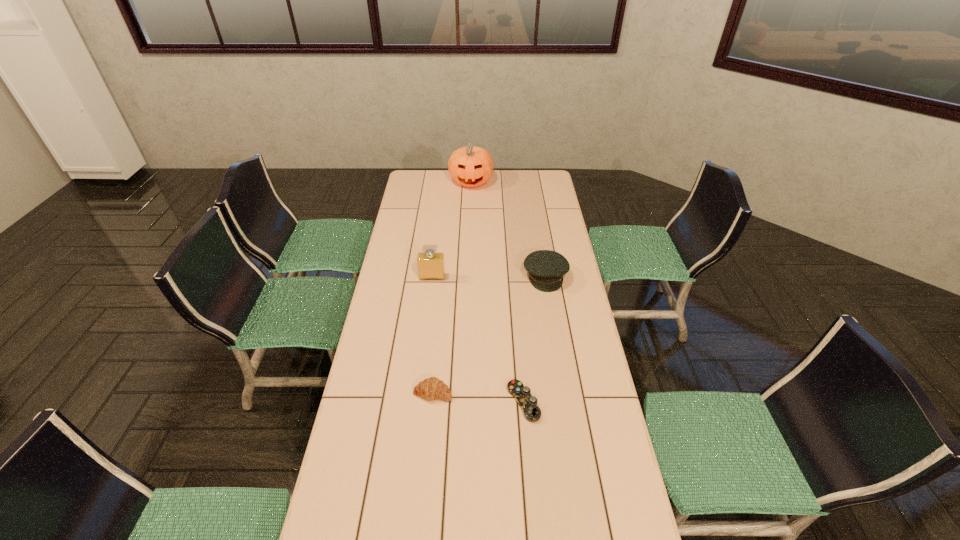
You are a GUI agent. You are given a task and a screenshot of the screen. Output one action in this format:
    pyautogui.click(x=<x>, y=<y>)
    Task: Click on the vacant point located between the shortest object and the perfume
    The width and height of the screenshot is (960, 540).
    Given the screenshot: What is the action you would take?
    pyautogui.click(x=478, y=340)

This screenshot has height=540, width=960. Find the location of `empty space between the crescent roll and the control`. empty space between the crescent roll and the control is located at coordinates (478, 397).

This screenshot has height=540, width=960. What are the coordinates of `blank region between the tallest object and the crescent roll` in the screenshot? It's located at (452, 287).

You are a GUI agent. You are given a task and a screenshot of the screen. Output one action in this format:
    pyautogui.click(x=<x>, y=<y>)
    Task: Click on the free space that is in between the farthest object and the shortest object
    Image resolution: width=960 pixels, height=540 pixels.
    Given the screenshot: What is the action you would take?
    pyautogui.click(x=497, y=292)

Locate an element on the screen. This screenshot has width=960, height=540. vacant area between the fourth shortest object and the fourth tallest object is located at coordinates (433, 335).

You are a GUI agent. You are given a task and a screenshot of the screen. Output one action in this format:
    pyautogui.click(x=<x>, y=<y>)
    Task: Click on the empty space between the pumpkin and the shortest object
    The image size is (960, 540).
    Given the screenshot: What is the action you would take?
    pyautogui.click(x=497, y=292)

Find the location of a particular element. Image resolution: width=960 pixels, height=540 pixels. vacant area that lies between the perfume and the shortest object is located at coordinates (478, 340).

Where is `free space between the pumpkin and the control`? free space between the pumpkin and the control is located at coordinates click(497, 292).

At what (x,y) coordinates should I click in order to perform the action: click on empty location between the second shortest object and the pumpkin. Please return your answer as a coordinate pair (x, y). Looking at the image, I should click on (452, 287).

Locate an element on the screen. Image resolution: width=960 pixels, height=540 pixels. object that is the fourth closest to the third shortest object is located at coordinates (470, 166).